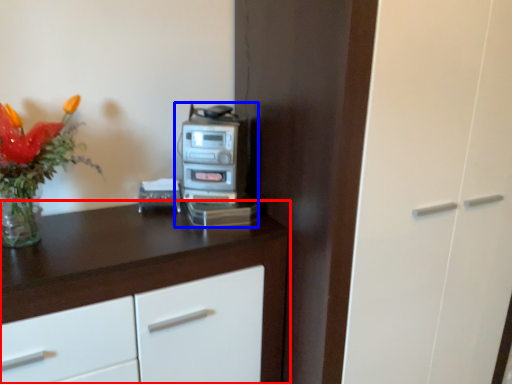
Question: Among these objects, which one is farthest to the camera, cabinetry (highlighted by a red box) or home appliance (highlighted by a blue box)?

Choices:
 (A) cabinetry
 (B) home appliance

Answer: (B)